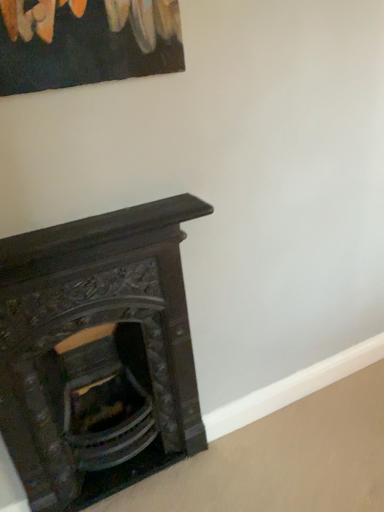
Identify the location of free space above dark wood fireplace at lower left (from a real-world perspective). (95, 217).